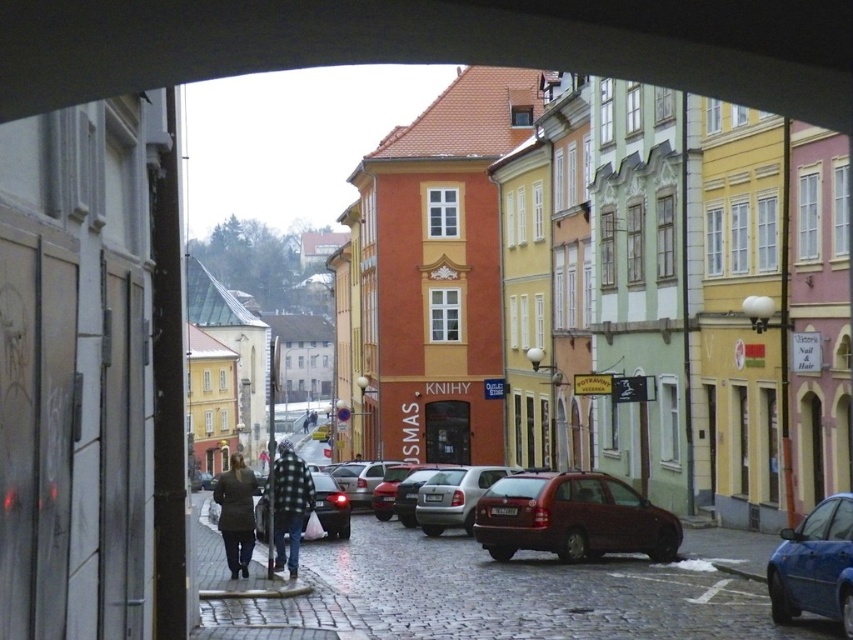
You are a delivery driver who needs to park your vehicle in this street. You have a large truck that is 6 meters long. The parking space here can only accommodate vehicles up to 5 meters in length. Looking at the silver metallic car at center and the shiny black sedan at center, which one is more likely to fit in the parking space?

The shiny black sedan at center is smaller in size compared to the silver metallic car at center, so it is more likely to fit in the parking space that can only accommodate vehicles up to 5 meters in length.

In the scene shown: You are a delivery driver trying to park your van, which is 2 meters tall, in a parking spot located between the silver metallic car at center and the shiny black sedan at center. Based on the scene, can your van fit vertically between these two vehicles?

The silver metallic car at center is much taller than the shiny black sedan at center. Since the van is 2 meters tall, it can fit vertically between them as long as the height of the shorter vehicle does not exceed 2 meters. However, without specific height measurements, we cannot confirm if the space is sufficient.

You are standing at the entrance of the arched opening looking down the cobblestone street. You notice a shiny red car at center. Where exactly is the shiny red car at center located in relation to the point marked at coordinates point (572, 516)?

The shiny red car at center is located exactly at the point marked at coordinates point (572, 516).